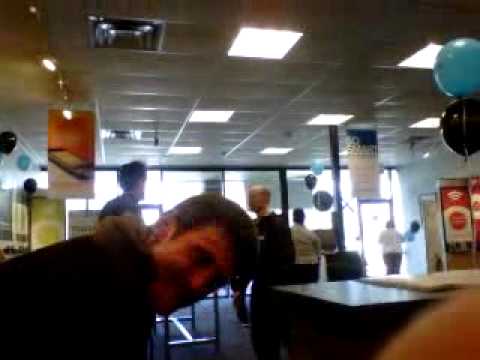
Locate an element on the screen. floor is located at coordinates (235, 338), (224, 320), (206, 307).